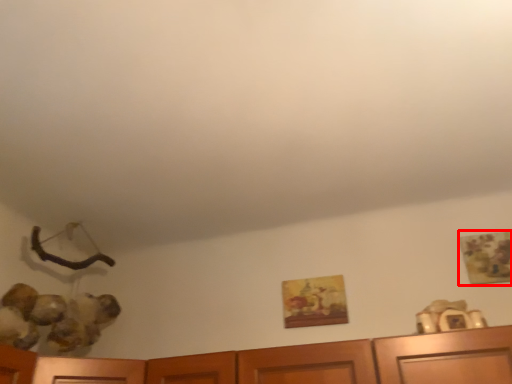
Question: Considering the relative positions of picture frame (annotated by the red box) and picture frame in the image provided, where is picture frame (annotated by the red box) located with respect to the staircase?

Choices:
 (A) right
 (B) left

Answer: (A)